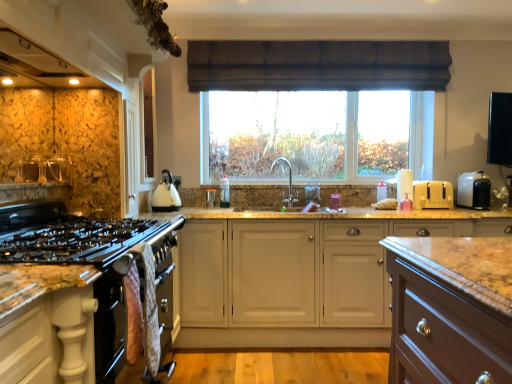
Question: Is black glass gas stove at left positioned with its back to white plastic toaster at right, marked as the first appliance in a right-to-left arrangement?

Choices:
 (A) yes
 (B) no

Answer: (B)

Question: From the image's perspective, is black glass gas stove at left over white plastic toaster at right, the 2th appliance from the left?

Choices:
 (A) no
 (B) yes

Answer: (A)

Question: Is black glass gas stove at left positioned in front of white plastic toaster at right, the 2th appliance from the left?

Choices:
 (A) yes
 (B) no

Answer: (A)

Question: Is black glass gas stove at left at the right side of white plastic toaster at right, marked as the first appliance in a right-to-left arrangement?

Choices:
 (A) yes
 (B) no

Answer: (B)

Question: From a real-world perspective, is black glass gas stove at left below white plastic toaster at right, the 2th appliance from the left?

Choices:
 (A) yes
 (B) no

Answer: (A)

Question: Is black glass gas stove at left wider than white plastic toaster at right, the 2th appliance from the left?

Choices:
 (A) yes
 (B) no

Answer: (A)

Question: Can we say matte white exhaust hood at upper left lies outside white matte cabinet at center, which is the 1th cabinetry from back to front?

Choices:
 (A) yes
 (B) no

Answer: (A)

Question: Does matte white exhaust hood at upper left have a lesser width compared to white matte cabinet at center, which is the 1th cabinetry from back to front?

Choices:
 (A) yes
 (B) no

Answer: (A)

Question: Can you see matte white exhaust hood at upper left touching white matte cabinet at center, positioned as the 1th cabinetry in right-to-left order?

Choices:
 (A) no
 (B) yes

Answer: (A)

Question: Considering the relative sizes of matte white exhaust hood at upper left and white matte cabinet at center, marked as the second cabinetry in a front-to-back arrangement, in the image provided, is matte white exhaust hood at upper left taller than white matte cabinet at center, marked as the second cabinetry in a front-to-back arrangement,?

Choices:
 (A) yes
 (B) no

Answer: (B)

Question: Is matte white exhaust hood at upper left behind white matte cabinet at center, which is the 1th cabinetry from back to front?

Choices:
 (A) yes
 (B) no

Answer: (B)

Question: From a real-world perspective, is matte white exhaust hood at upper left located higher than white matte cabinet at center, arranged as the 2th cabinetry when viewed from the left?

Choices:
 (A) no
 (B) yes

Answer: (B)

Question: Does white plastic toaster at right, the 2th appliance from the left, touch brown fabric curtain at upper center?

Choices:
 (A) no
 (B) yes

Answer: (A)